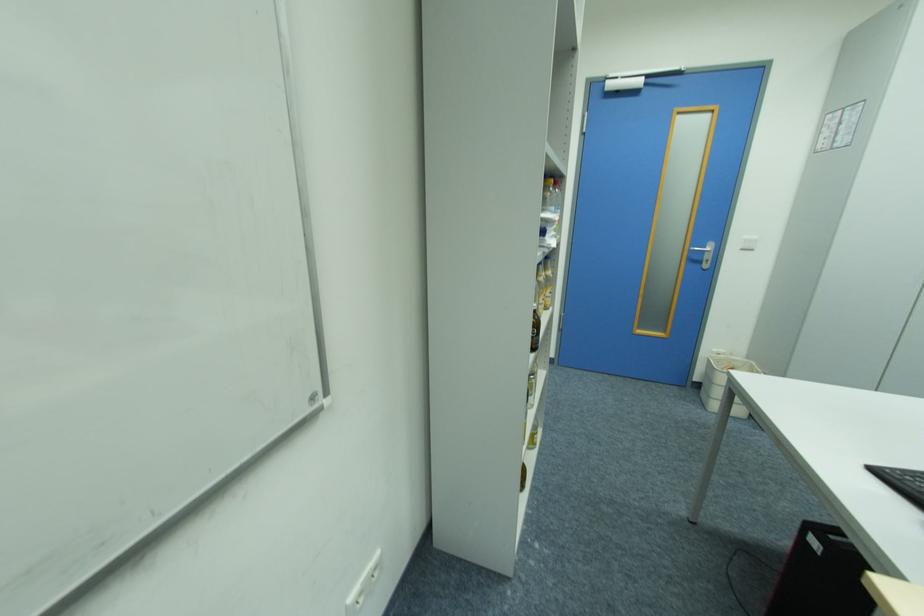
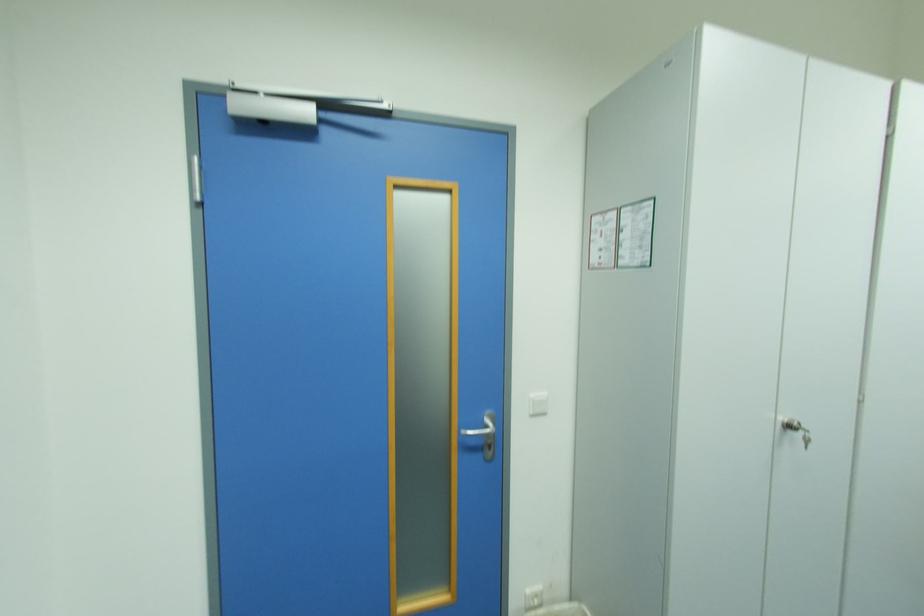
Where in the second image is the point corresponding to (x=752, y=238) from the first image?

(540, 395)